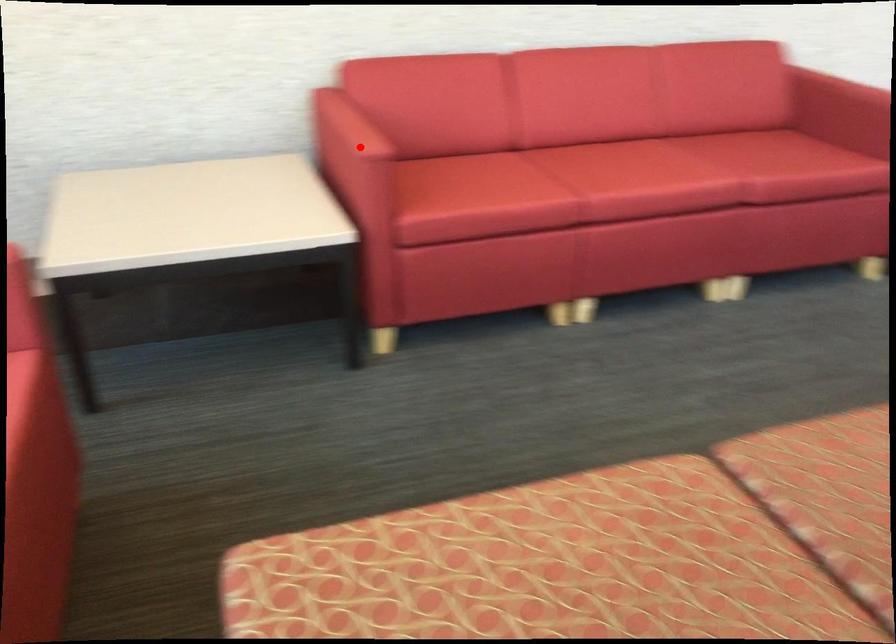
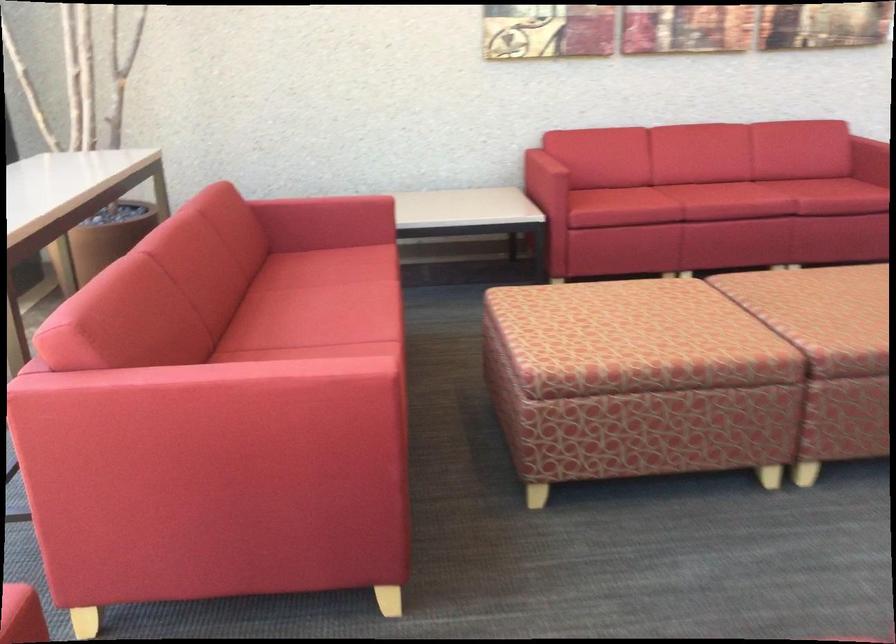
In the second image, find the point that corresponds to the highlighted location in the first image.

(545, 166)